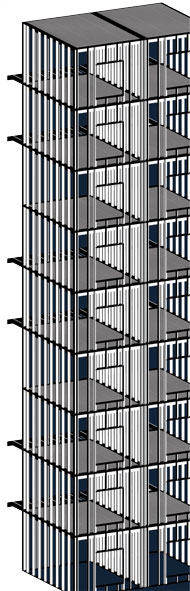
Where is `first floor rooms`? The width and height of the screenshot is (190, 591). first floor rooms is located at coordinates (97, 571), (173, 563).